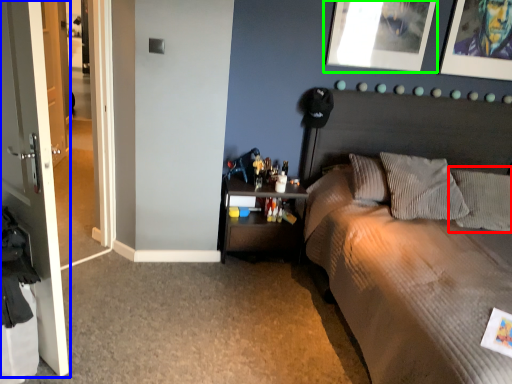
Question: Based on their relative distances, which object is farther from pillow (highlighted by a red box)? Choose from door (highlighted by a blue box) and picture frame (highlighted by a green box).

Choices:
 (A) door
 (B) picture frame

Answer: (A)